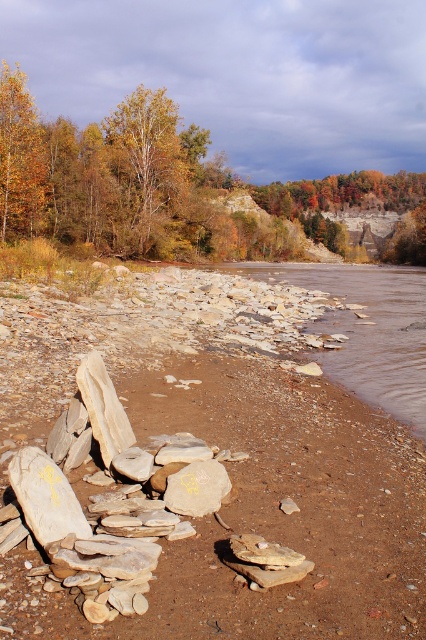
Question: Does smooth stone rocks at center have a larger size compared to golden-brown bark tree at center?

Choices:
 (A) no
 (B) yes

Answer: (B)

Question: Is smooth stone rocks at center bigger than golden-brown bark tree at center?

Choices:
 (A) yes
 (B) no

Answer: (A)

Question: Does golden-brown bark tree at center have a larger size compared to golden yellow leaves at upper left?

Choices:
 (A) yes
 (B) no

Answer: (B)

Question: Which object is closer to the camera taking this photo?

Choices:
 (A) smooth stone rocks at center
 (B) golden yellow leaves at upper left

Answer: (A)

Question: Which of these objects is positioned farthest from the golden-brown bark tree at center?

Choices:
 (A) golden yellow leaves at upper left
 (B) smooth stone rocks at center

Answer: (B)

Question: Which of the following is the closest to the observer?

Choices:
 (A) (181, 413)
 (B) (158, 211)
 (C) (0, 122)

Answer: (A)